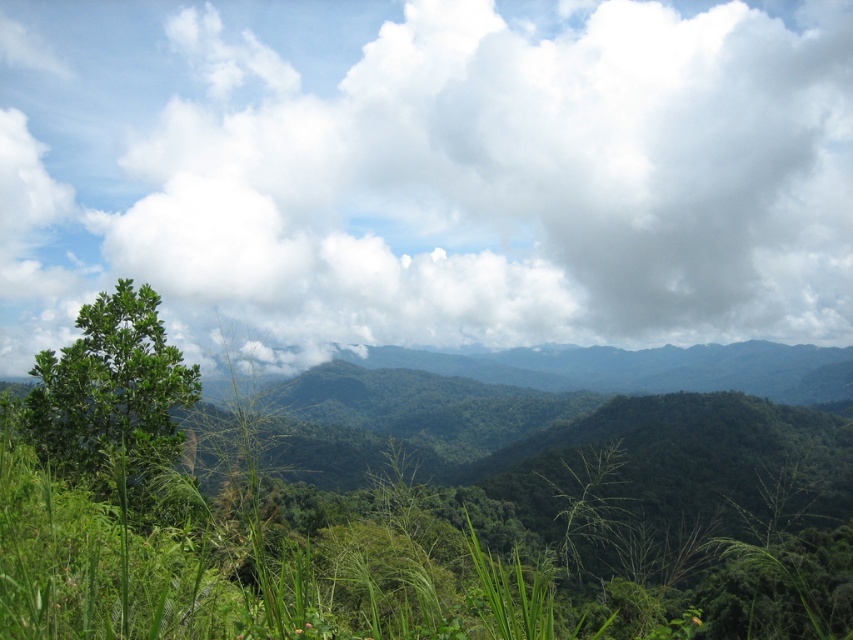
Can you confirm if white fluffy cloud at upper center is positioned to the right of green leafy tree at left?

Indeed, white fluffy cloud at upper center is positioned on the right side of green leafy tree at left.

Describe the element at coordinates (428, 170) in the screenshot. I see `white fluffy cloud at upper center` at that location.

Between point (627, 276) and point (160, 321), which one is positioned in front?

Point (160, 321) is more forward.

This screenshot has width=853, height=640. Find the location of `white fluffy cloud at upper center`. white fluffy cloud at upper center is located at coordinates (428, 170).